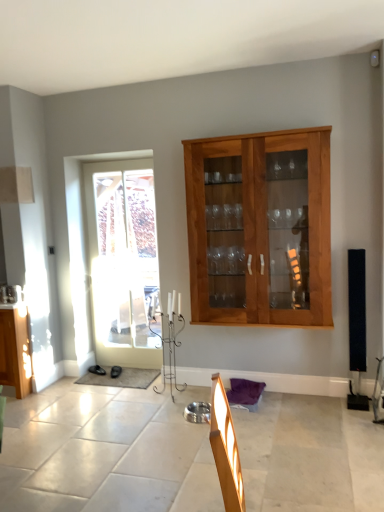
Question: Considering the positions of wooden cabinet at center and white glass door at left in the image, is wooden cabinet at center taller or shorter than white glass door at left?

Choices:
 (A) tall
 (B) short

Answer: (B)

Question: From a real-world perspective, is wooden cabinet at center above or below white glass door at left?

Choices:
 (A) below
 (B) above

Answer: (B)

Question: Which object is the closest to the white glass door at left?

Choices:
 (A) black matte speaker at right
 (B) wooden cabinet at center

Answer: (B)

Question: Considering the real-world distances, which object is closest to the black matte speaker at right?

Choices:
 (A) white glass door at left
 (B) wooden cabinet at center

Answer: (B)